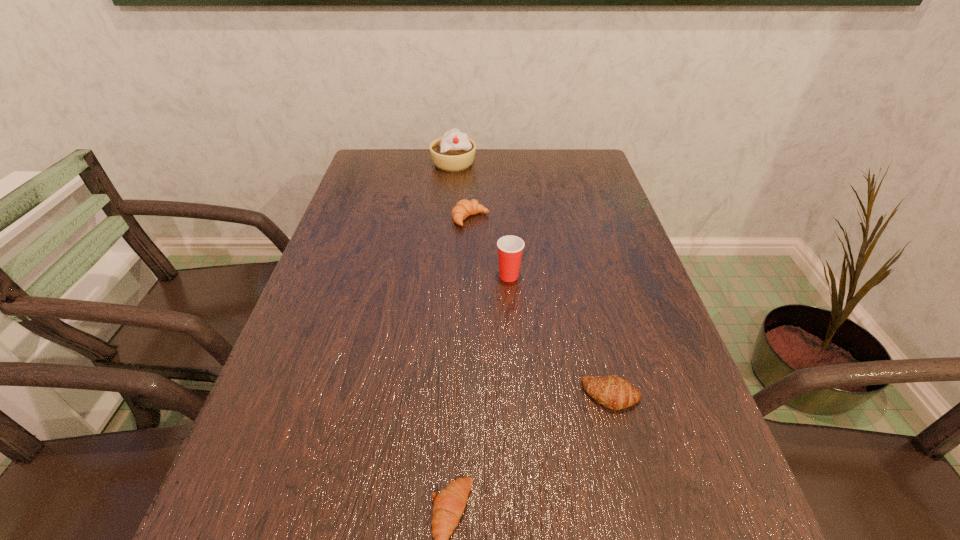
Where is `object present at the far edge`? object present at the far edge is located at coordinates coord(453,152).

Locate an element on the screen. The width and height of the screenshot is (960, 540). object that is at the right edge is located at coordinates (616, 393).

In the image, there is a desktop. At what (x,y) coordinates should I click in order to perform the action: click on vacant space at the far edge. Please return your answer as a coordinate pair (x, y). The height and width of the screenshot is (540, 960). Looking at the image, I should click on (492, 168).

The width and height of the screenshot is (960, 540). Find the location of `free region at the left edge of the desktop`. free region at the left edge of the desktop is located at coordinates (235, 536).

At what (x,y) coordinates should I click in order to perform the action: click on blank space at the right edge of the desktop. Please return your answer as a coordinate pair (x, y). The image size is (960, 540). Looking at the image, I should click on (656, 418).

At what (x,y) coordinates should I click in order to perform the action: click on vacant area at the far left corner. Please return your answer as a coordinate pair (x, y). Image resolution: width=960 pixels, height=540 pixels. Looking at the image, I should click on pyautogui.click(x=409, y=166).

The width and height of the screenshot is (960, 540). In order to click on vacant space at the far right corner of the desktop in this screenshot , I will do `click(581, 182)`.

This screenshot has height=540, width=960. In order to click on vacant space that is in between the second object from right to left and the second farthest crescent roll in this screenshot , I will do `click(561, 335)`.

The width and height of the screenshot is (960, 540). I want to click on unoccupied position between the farthest object and the Dixie cup, so click(x=481, y=220).

Locate an element on the screen. This screenshot has width=960, height=540. free space between the second farthest object and the second nearest crescent roll is located at coordinates (541, 307).